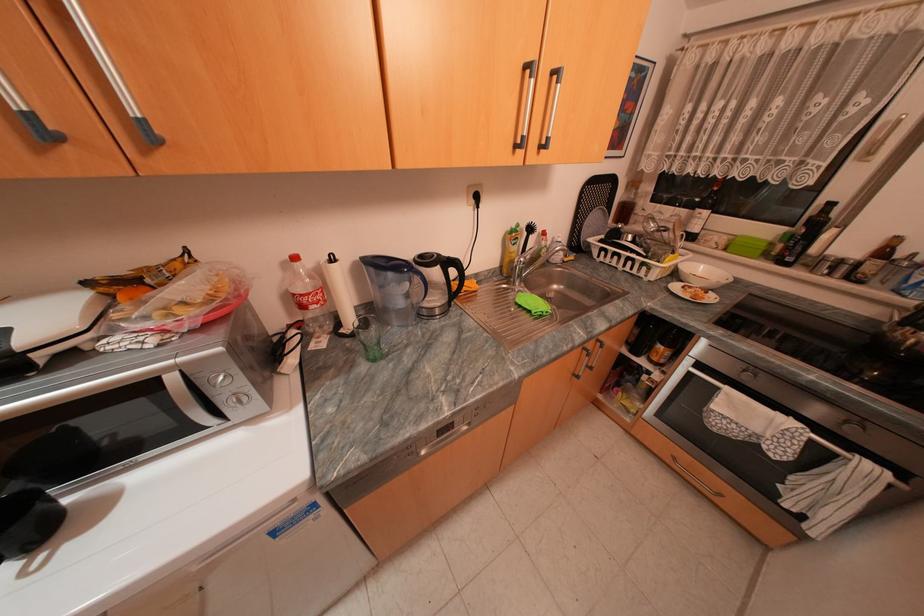
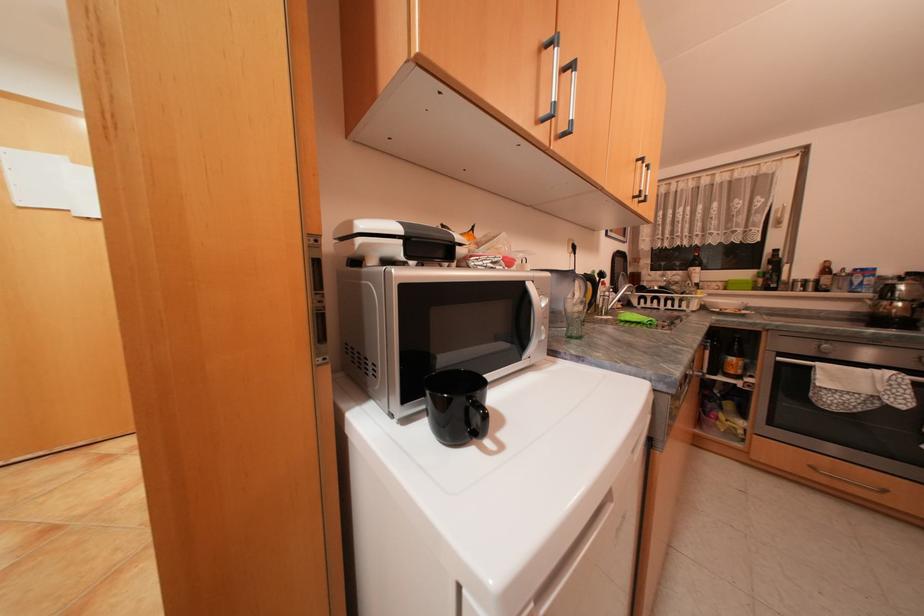
The point at (528, 225) is marked in the first image. Where is the corresponding point in the second image?

(602, 270)